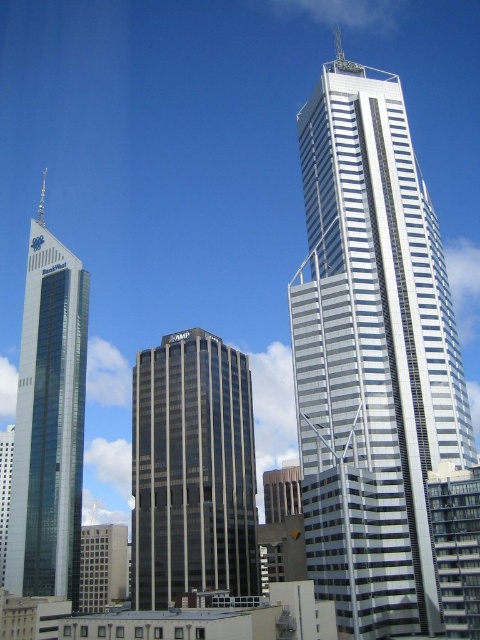
Is white glass skyscraper at upper right above glassy reflective skyscraper at left?

Yes, white glass skyscraper at upper right is above glassy reflective skyscraper at left.

Can you confirm if white glass skyscraper at upper right is positioned below glassy reflective skyscraper at left?

Incorrect, white glass skyscraper at upper right is not positioned below glassy reflective skyscraper at left.

At what (x,y) coordinates should I click in order to perform the action: click on white glass skyscraper at upper right. Please return your answer as a coordinate pair (x, y). Image resolution: width=480 pixels, height=640 pixels. Looking at the image, I should click on (380, 376).

You are a GUI agent. You are given a task and a screenshot of the screen. Output one action in this format:
    pyautogui.click(x=<x>, y=<y>)
    Task: Click on the white glass skyscraper at upper right
    
    Given the screenshot: What is the action you would take?
    pyautogui.click(x=380, y=376)

Which is behind, point (245, 410) or point (48, 320)?

Point (48, 320)

Is dark gray glass building at center smaller than glassy reflective skyscraper at left?

Correct, dark gray glass building at center occupies less space than glassy reflective skyscraper at left.

Between point (229, 467) and point (80, 467), which one is positioned behind?

Positioned behind is point (80, 467).

Locate an element on the screen. dark gray glass building at center is located at coordinates (192, 470).

Which is in front, point (372, 307) or point (152, 353)?

Point (372, 307)

Between white glass skyscraper at upper right and dark gray glass building at center, which one appears on the right side from the viewer's perspective?

white glass skyscraper at upper right

Which is behind, point (411, 385) or point (216, 573)?

Point (216, 573)

Find the location of a particular element. The image size is (480, 640). white glass skyscraper at upper right is located at coordinates (380, 376).